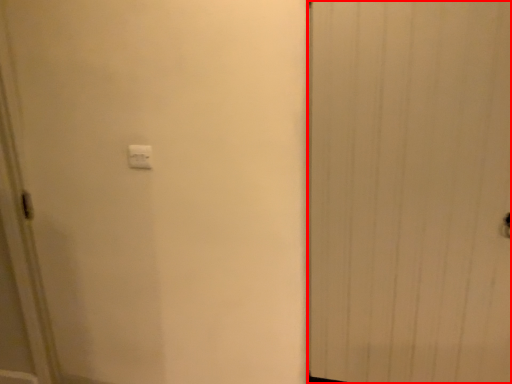
Question: From the image's perspective, where is door (annotated by the red box) located relative to light switch?

Choices:
 (A) below
 (B) above

Answer: (A)